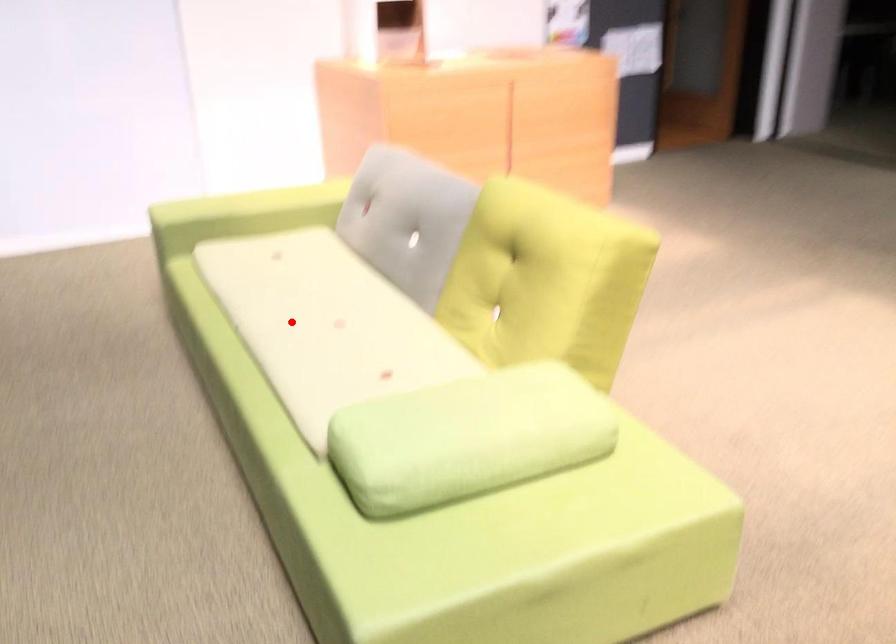
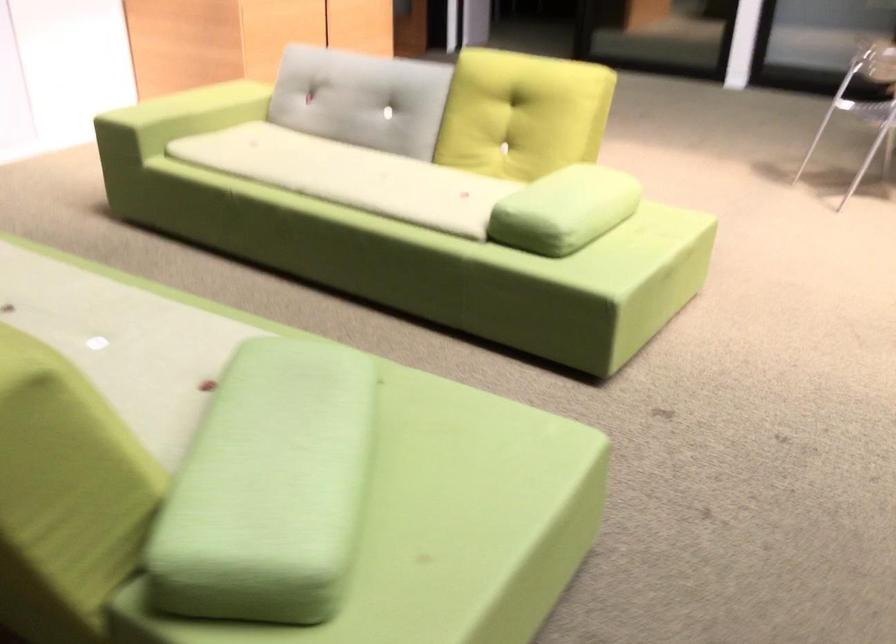
Question: I am providing you with two images of the same scene from different viewpoints. Image1 has a red point marked. In image2, the corresponding 3D location appears at what relative position? Reply with the corresponding letter.

Choices:
 (A) Closer
 (B) Farther

Answer: (B)